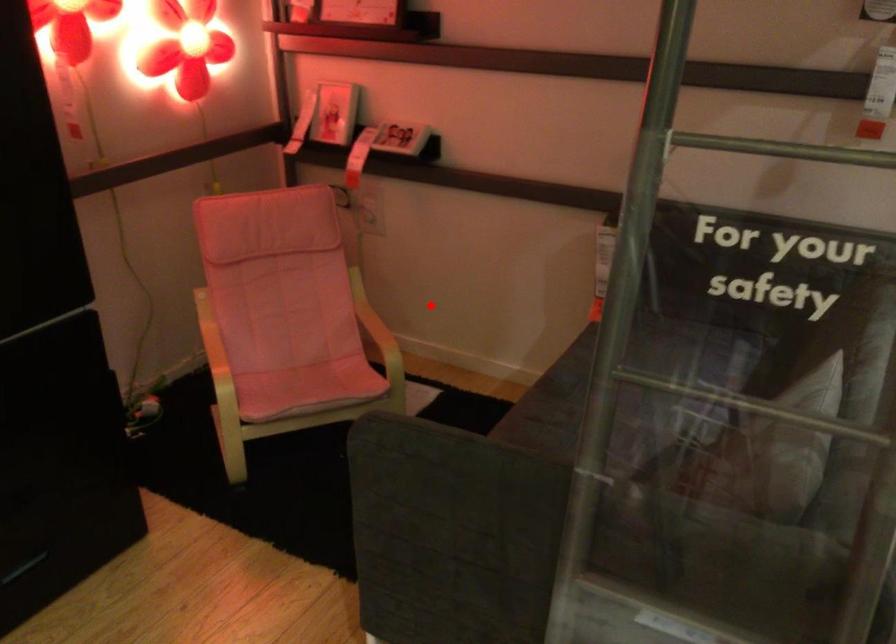
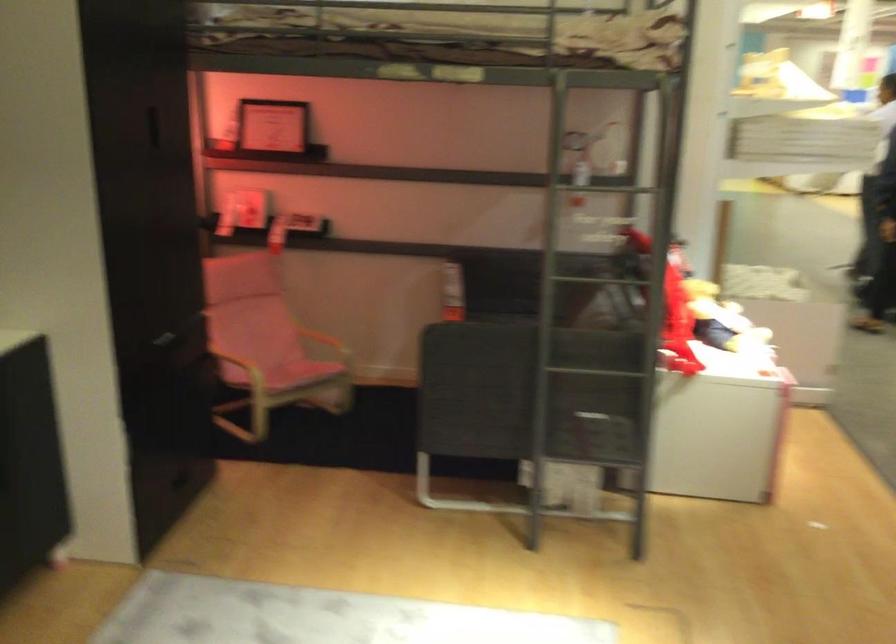
Locate, in the second image, the point that corresponds to the highlighted location in the first image.

(332, 328)